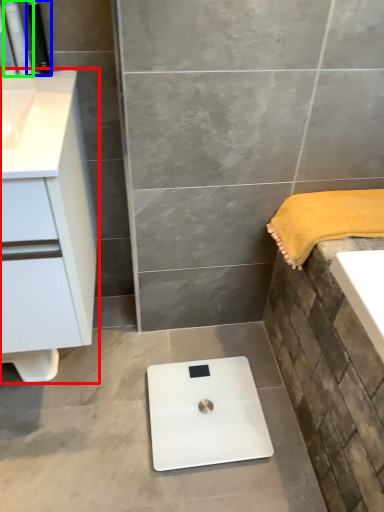
Question: Which is farther away from bathroom cabinet (highlighted by a red box)? toiletry (highlighted by a blue box) or toiletry (highlighted by a green box)?

Choices:
 (A) toiletry
 (B) toiletry

Answer: (B)